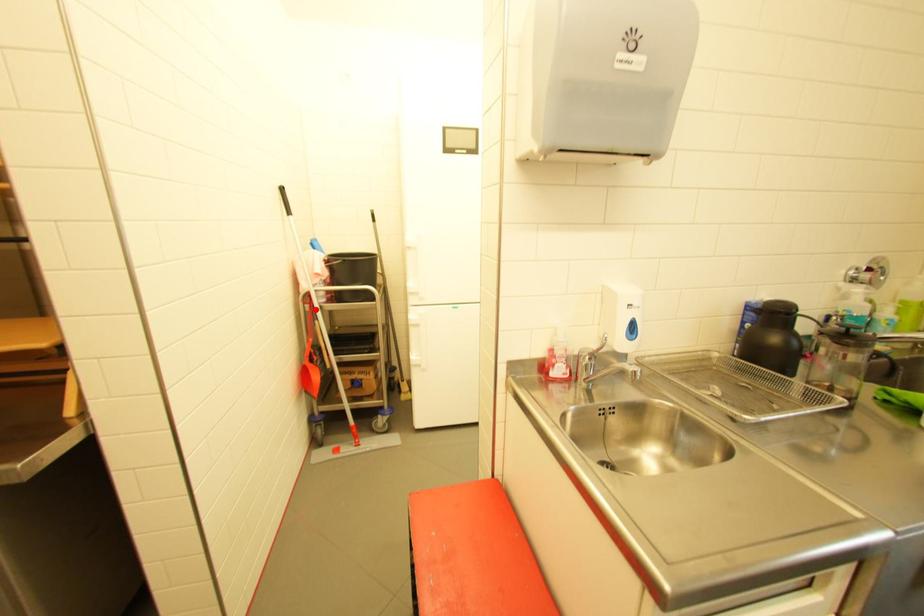
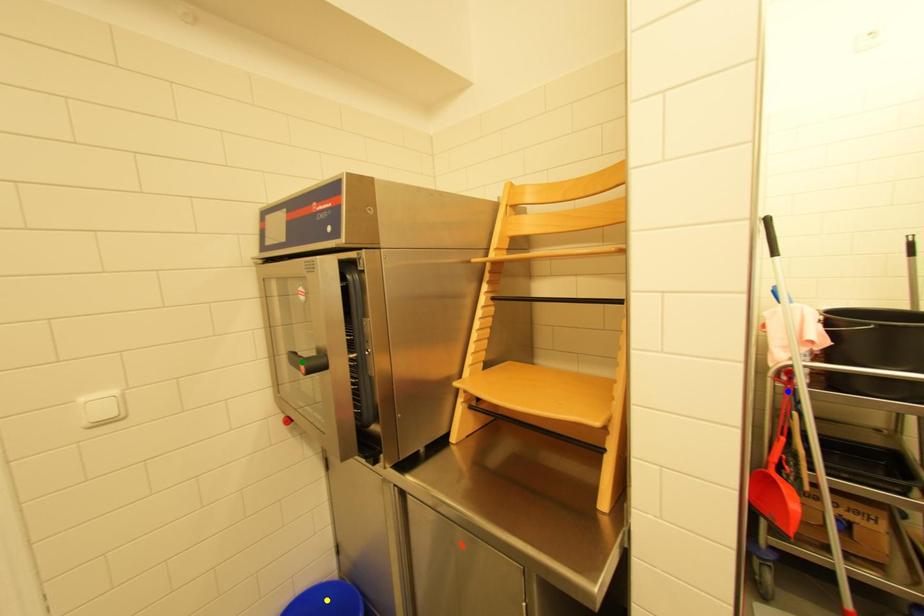
Question: I am providing you with two images of the same scene from different viewpoints. A red point is marked on the first image. You are given multiple points on the second image. Which mark in image 2 goes with the point in image 1?

Choices:
 (A) blue point
 (B) yellow point
 (C) green point

Answer: (A)